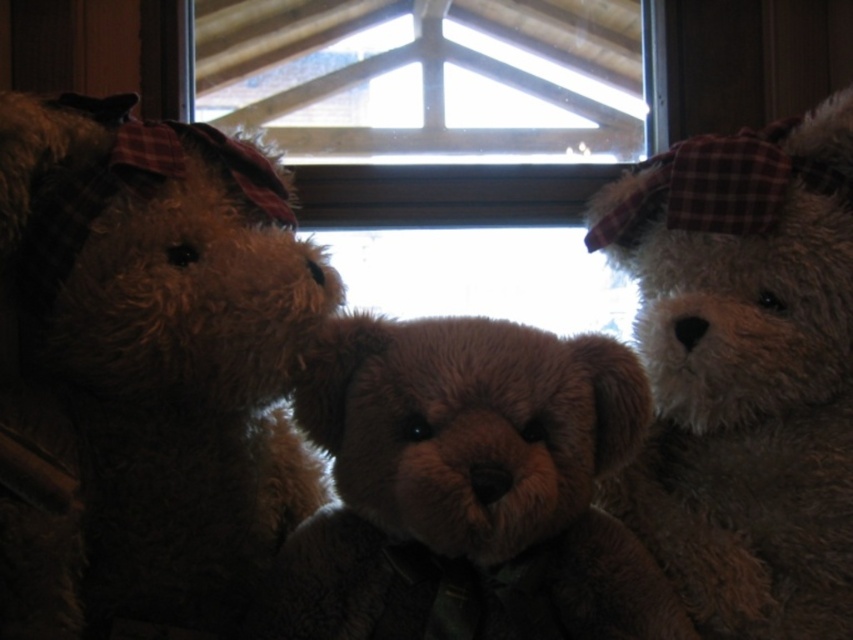
Question: Is brown plush teddy bear at left smaller than brown plush teddy bear at center?

Choices:
 (A) yes
 (B) no

Answer: (B)

Question: Among these objects, which one is farthest from the camera?

Choices:
 (A) transparent glass window at center
 (B) brown plush teddy bear at center
 (C) white plush bear at upper right
 (D) brown plush teddy bear at left

Answer: (A)

Question: Is white plush bear at upper right to the right of brown plush teddy bear at center from the viewer's perspective?

Choices:
 (A) yes
 (B) no

Answer: (A)

Question: Which object is closer to the camera taking this photo?

Choices:
 (A) transparent glass window at center
 (B) brown plush teddy bear at left
 (C) brown plush teddy bear at center

Answer: (B)

Question: Among these objects, which one is farthest from the camera?

Choices:
 (A) transparent glass window at center
 (B) brown plush teddy bear at left
 (C) white plush bear at upper right

Answer: (A)

Question: Is white plush bear at upper right thinner than brown plush teddy bear at center?

Choices:
 (A) no
 (B) yes

Answer: (B)